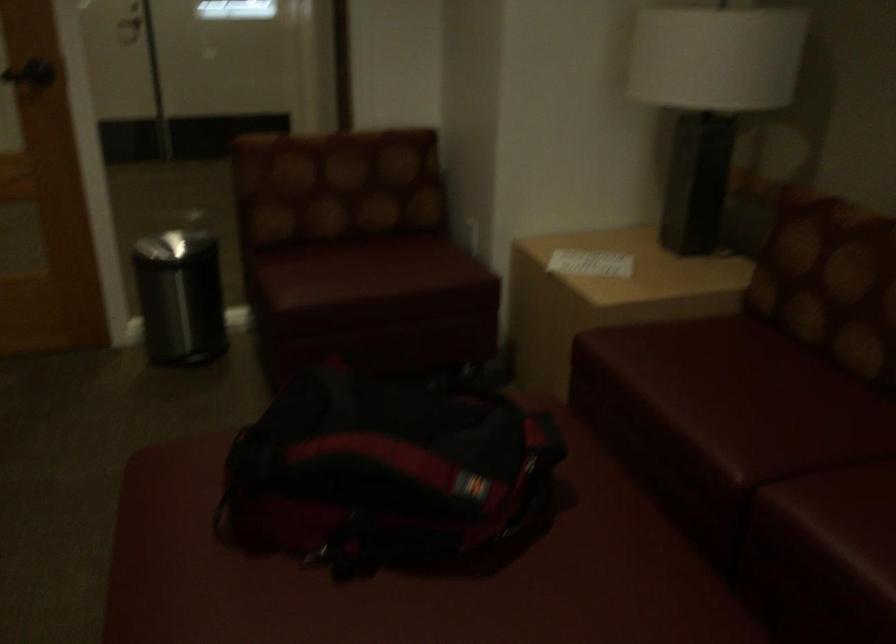
Locate an element on the screen. black and red backpack is located at coordinates (384, 471).